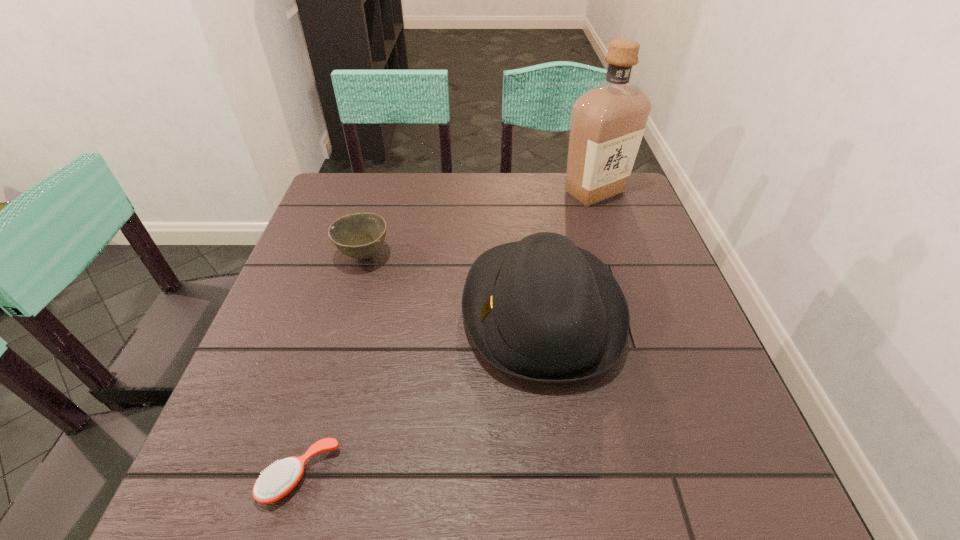
At what (x,y) coordinates should I click in order to perform the action: click on vacant region that satisfies the following two spatial constraints: 1. on the front-facing side of the farthest object; 2. on the front-facing side of the fedora. Please return your answer as a coordinate pair (x, y). Looking at the image, I should click on (635, 311).

Where is `free space that satisfies the following two spatial constraints: 1. on the front-facing side of the fedora; 2. on the front side of the nearest object`? Image resolution: width=960 pixels, height=540 pixels. free space that satisfies the following two spatial constraints: 1. on the front-facing side of the fedora; 2. on the front side of the nearest object is located at coordinates (564, 475).

This screenshot has height=540, width=960. I want to click on free region that satisfies the following two spatial constraints: 1. on the front-facing side of the farthest object; 2. on the front-facing side of the second tallest object, so click(635, 311).